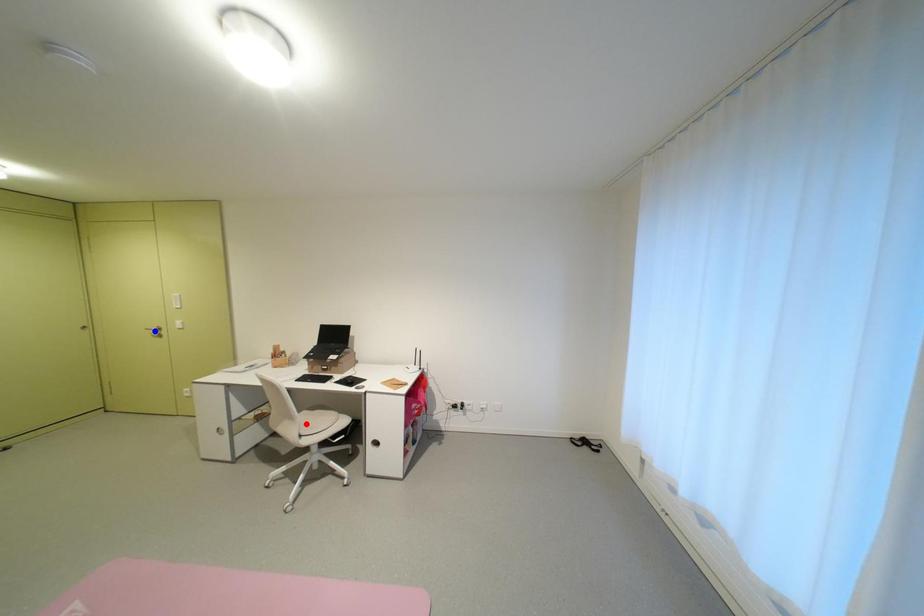
Question: Which of the two points in the image is closer to the camera?

Choices:
 (A) Blue point is closer.
 (B) Red point is closer.

Answer: (B)